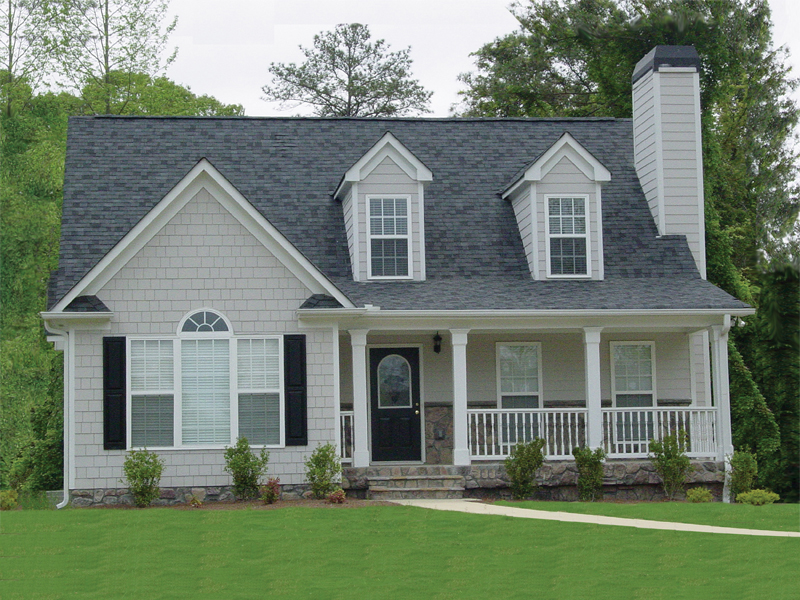
Locate an element on the screen. The width and height of the screenshot is (800, 600). windows is located at coordinates (385, 233), (574, 232), (634, 376), (517, 385), (208, 377), (398, 388).